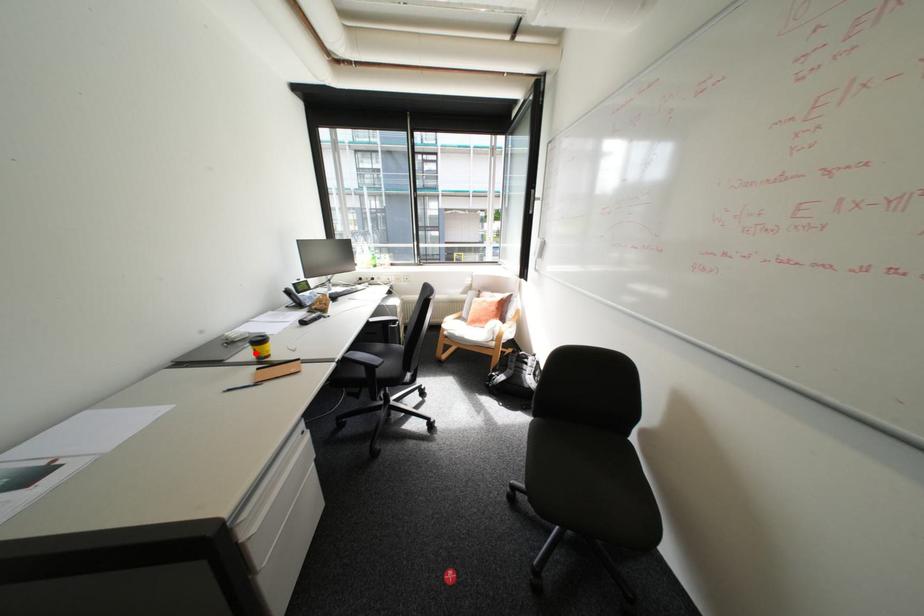
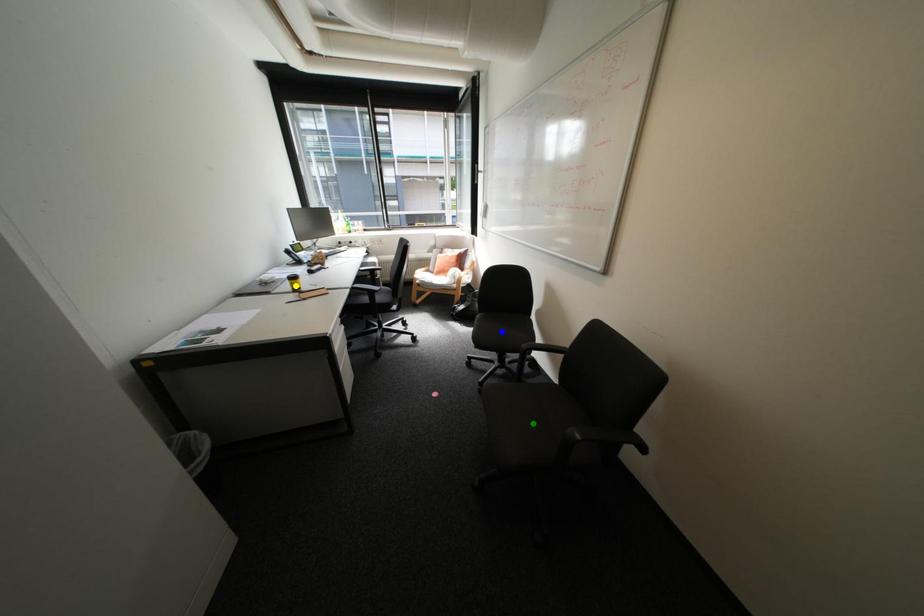
Question: I am providing you with two images of the same scene from different viewpoints. A red point is marked on the first image. You are given multiple points on the second image. Which point in image 2 is actually the same real-world point as the red point in image 1?

Choices:
 (A) blue point
 (B) yellow point
 (C) green point

Answer: (B)